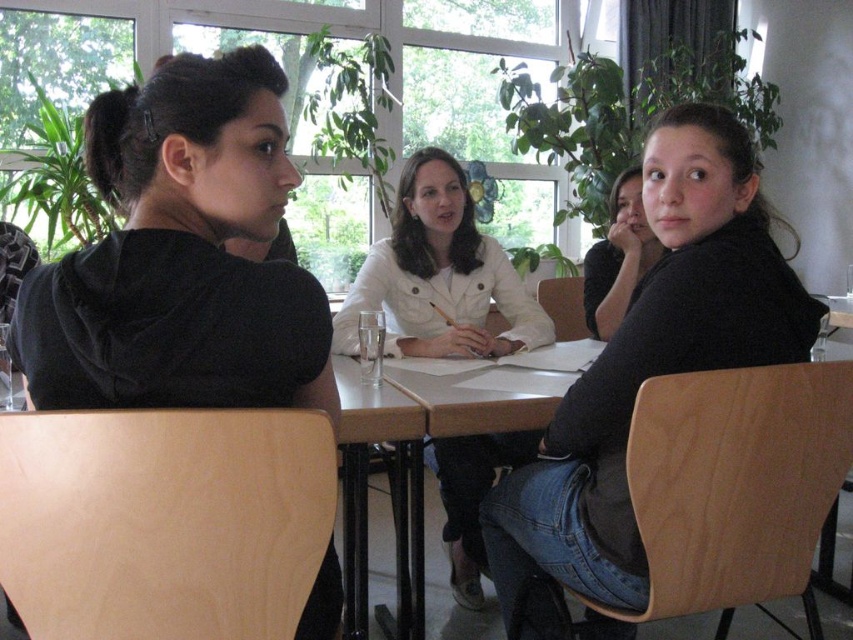
You are a photographer trying to capture a group photo of the white matte jacket at center and the black matte shirt at upper right. Based on their positions in the image, which one is located lower in the frame?

The white matte jacket at center is located lower in the frame than the black matte shirt at upper right.

You are a photographer positioned at the back of the room. You want to take a photo of the black velvet shirt at left and the black plastic table at center. Which object will appear larger in your photo?

The black velvet shirt at left will appear larger in the photo because it is closer to the viewer than the black plastic table at center.